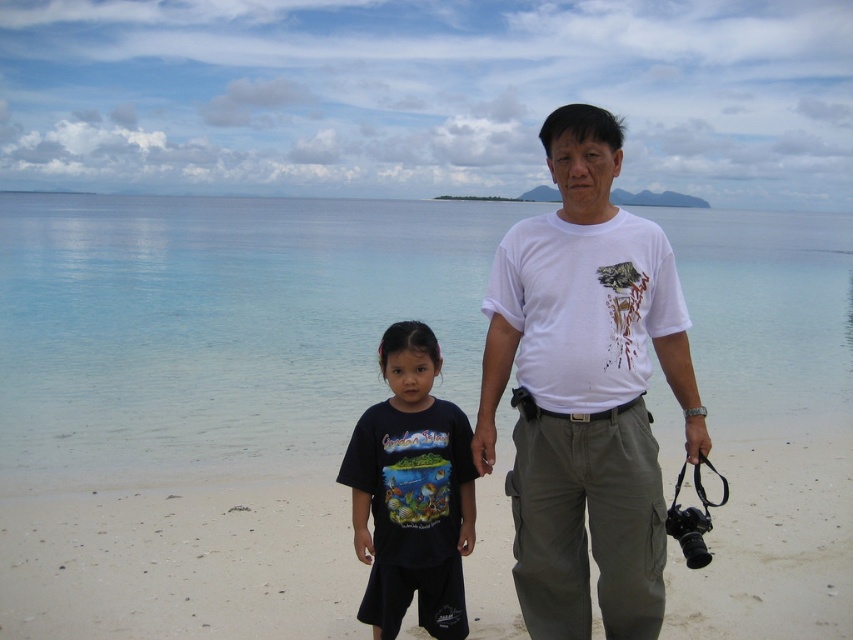
You are a photographer trying to capture a photo of the clear blue water at center and the black cotton shirt at center. Which object is positioned to the right of the other?

The clear blue water at center is to the right of the black cotton shirt at center.

Looking at this image, you are standing on the beach and want to take a photo of the clear blue water at center. Where should you look to capture it in your camera?

The clear blue water at center is located at point coordinates of (219, 326), so you should aim your camera towards that position to capture it.